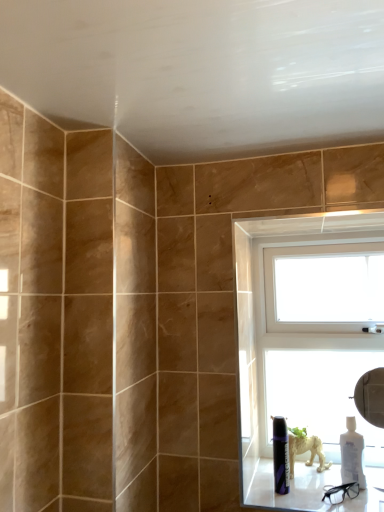
Question: Considering the relative sizes of white plastic window at upper right and white glossy window sill at lower right in the image provided, is white plastic window at upper right bigger than white glossy window sill at lower right?

Choices:
 (A) no
 (B) yes

Answer: (B)

Question: Is white glossy window sill at lower right at the back of white plastic window at upper right?

Choices:
 (A) no
 (B) yes

Answer: (A)

Question: Is white plastic window at upper right completely or partially outside of white glossy window sill at lower right?

Choices:
 (A) yes
 (B) no

Answer: (A)

Question: Can you confirm if white plastic window at upper right is taller than white glossy window sill at lower right?

Choices:
 (A) no
 (B) yes

Answer: (B)

Question: Considering the relative sizes of white plastic window at upper right and white glossy window sill at lower right in the image provided, is white plastic window at upper right thinner than white glossy window sill at lower right?

Choices:
 (A) no
 (B) yes

Answer: (B)

Question: From the image's perspective, is white plastic window at upper right located beneath white glossy window sill at lower right?

Choices:
 (A) yes
 (B) no

Answer: (B)

Question: Can you confirm if white glossy window sill at lower right is smaller than matte black can at lower right?

Choices:
 (A) no
 (B) yes

Answer: (A)

Question: Is matte black can at lower right surrounded by white glossy window sill at lower right?

Choices:
 (A) no
 (B) yes

Answer: (A)

Question: Can you confirm if white glossy window sill at lower right is wider than matte black can at lower right?

Choices:
 (A) yes
 (B) no

Answer: (A)

Question: Considering the relative sizes of white glossy window sill at lower right and matte black can at lower right in the image provided, is white glossy window sill at lower right shorter than matte black can at lower right?

Choices:
 (A) no
 (B) yes

Answer: (B)

Question: Is white glossy window sill at lower right aimed at matte black can at lower right?

Choices:
 (A) no
 (B) yes

Answer: (A)

Question: Does white glossy window sill at lower right lie in front of matte black can at lower right?

Choices:
 (A) yes
 (B) no

Answer: (A)

Question: From the image's perspective, is white glossy bottle at lower right below white plastic window at upper right?

Choices:
 (A) yes
 (B) no

Answer: (A)